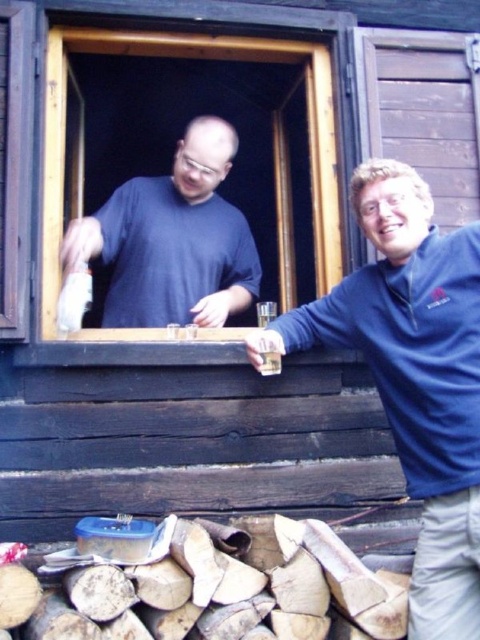
You are a delivery robot with a height of 1.6 meters. You are approaching the wooden frame at upper center. Can you pass under it without hitting your head?

The wooden frame at upper center is 2.11 meters away from the camera. Since the distance is measured from the camera to the frame, this does not indicate the height of the frame. Therefore, it is unclear if the delivery robot can pass under it without hitting its head based on the provided information.

You are standing in front of the wooden cabin and want to determine which of the two points, point (330, 198) or point (279, 371), is closer to you. Based on the scene description, which point is closer?

Point (279, 371) is closer to you because it is less further to the camera than point (330, 198) according to the description.

You are trying to hand the translucent glass beverage at window to the person wearing the blue fleece jacket at right. Can you reach them without moving the beverage?

The blue fleece jacket at right is positioned on the right side of the translucent glass beverage at window, so the beverage is closer to the person outside. Since the person inside is reaching out, they can hand the beverage to the person outside without needing to move it further.